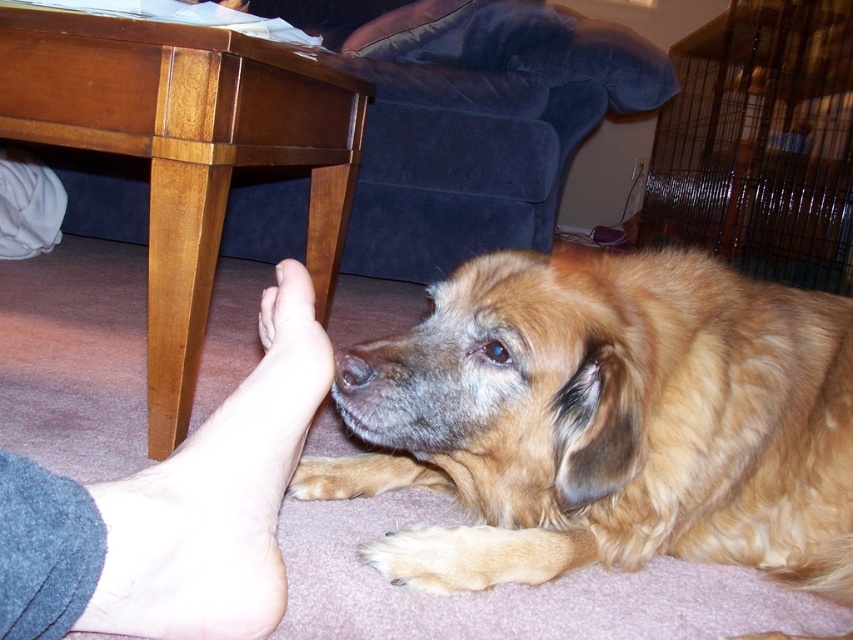
You are standing in the room and want to place a small plant on the wooden table at lower left. To do so, where should you walk to in the room?

The wooden table at lower left is located at the coordinates 0.239 on the x axis and 0.219 on the y axis, so you should walk towards that point to place the plant.